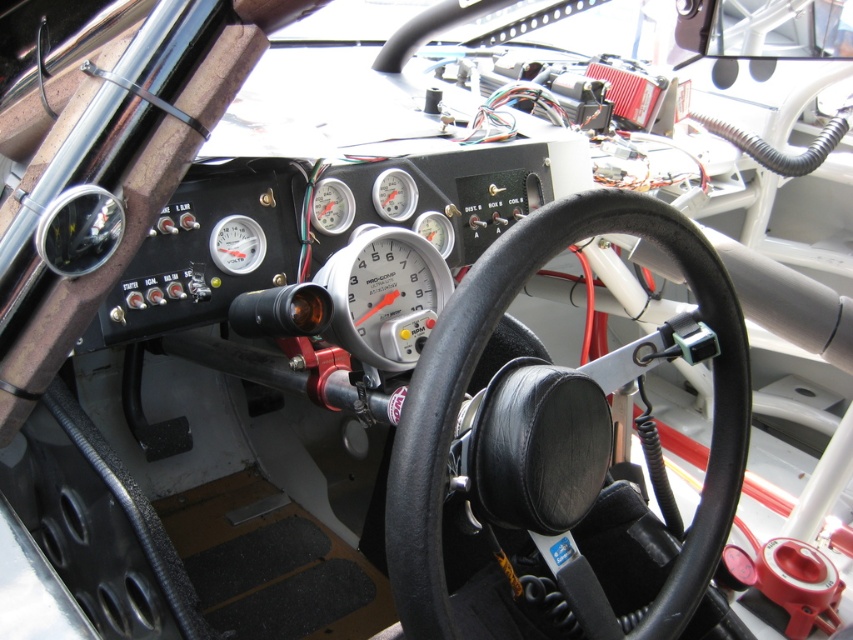
You are a race car driver preparing for a race. You notice two points on the dashboard. The first point is at coordinates point (415, 387) and the second is at point (381, 248). Which point is closer to you as you sit in the driver seat?

Point (415, 387) is in front of point (381, 248), so it is closer to you as you sit in the driver seat.

You are a race car driver preparing for a race. You need to check the speedometer to ensure it is functioning properly. Since you can only reach the controls within your immediate vicinity, can you confirm if the silver metallic speedometer at center is larger than the black leather steering wheel at center?

The black leather steering wheel at center is bigger than the silver metallic speedometer at center, so the speedometer is not larger than the steering wheel.

You are a race car driver preparing for a race. You need to check the speedometer while keeping your hands on the steering wheel. Can you reach the white plastic speedometer at center from the black leather steering wheel at center without moving your hands?

The black leather steering wheel at center is wider than the white plastic speedometer at center. Since the steering wheel is wider, it might block access to the speedometer if your hands are on it, making it difficult to reach without moving your hands.